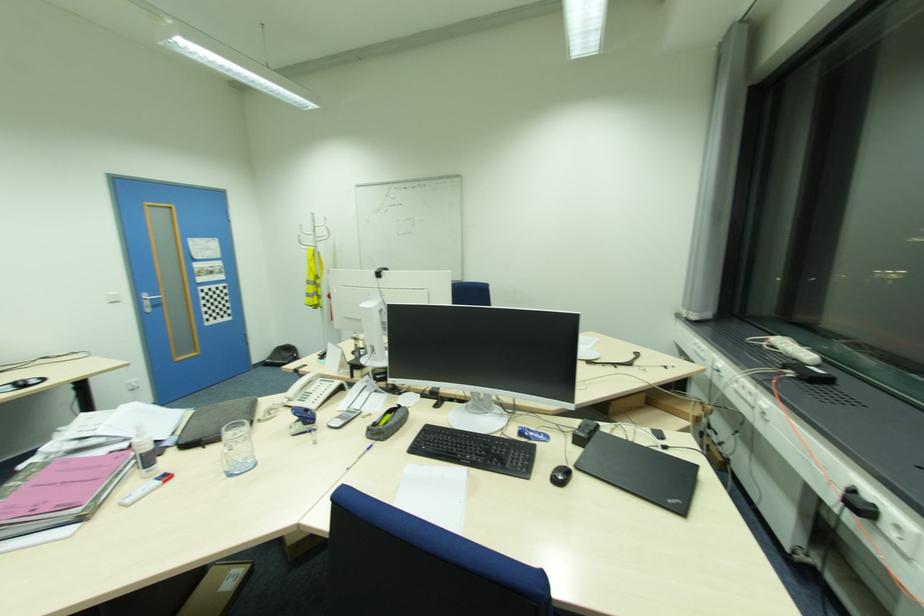
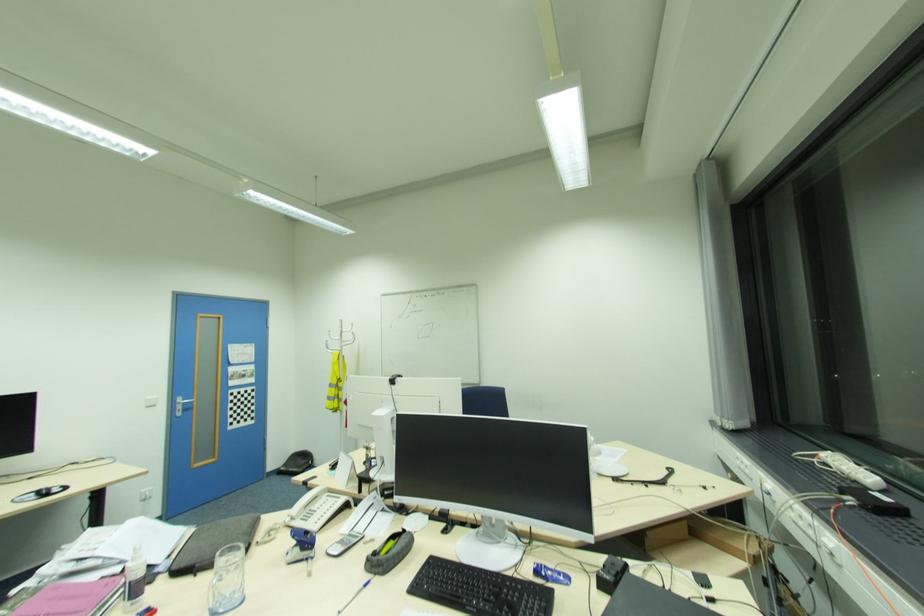
Find the pixel in the second image that matches point 186,440 in the first image.

(177, 568)